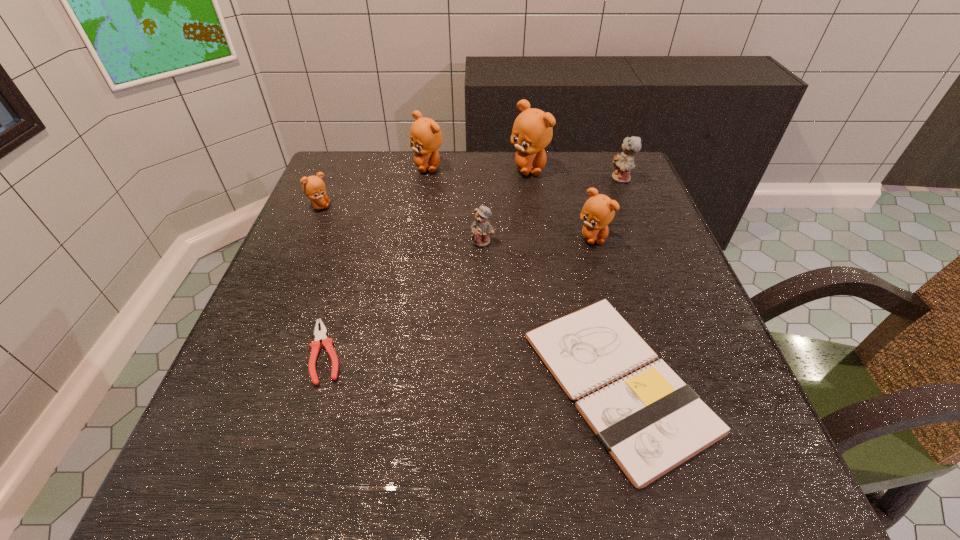
Identify the location of the nearer blue teddy bear. (481, 229).

Where is `the smaller blue teddy bear`? This screenshot has width=960, height=540. the smaller blue teddy bear is located at coordinates (481, 229).

The image size is (960, 540). Find the location of `notepad`. notepad is located at coordinates (650, 422).

This screenshot has height=540, width=960. In order to click on the shortest object in this screenshot , I will do `click(315, 346)`.

Where is `pliers`? The image size is (960, 540). pliers is located at coordinates (315, 346).

I want to click on vacant space located 0.390m on the face of the second brown teddy bear from right to left, so click(x=546, y=286).

Identify the location of vacant space located 0.170m on the face of the second biggest brown teddy bear. This screenshot has height=540, width=960. (420, 214).

Where is `vacant space located on the front-facing side of the farther blue teddy bear`? The width and height of the screenshot is (960, 540). vacant space located on the front-facing side of the farther blue teddy bear is located at coordinates (508, 179).

Find the location of a particular element. The height and width of the screenshot is (540, 960). free space located 0.230m on the front-facing side of the farther blue teddy bear is located at coordinates (523, 179).

The image size is (960, 540). Identify the location of free space located on the front-facing side of the farther blue teddy bear. (469, 179).